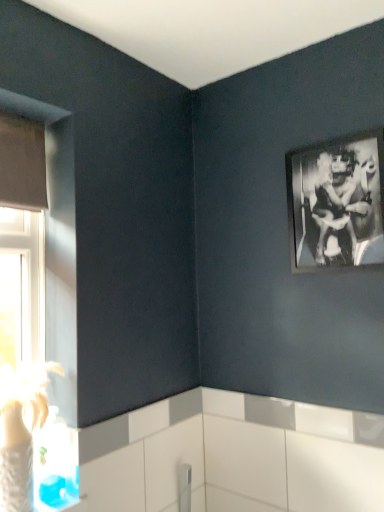
Measure the distance between black matte picture frame at upper right and camera.

The depth of black matte picture frame at upper right is 4.33 feet.

What do you see at coordinates (337, 204) in the screenshot? I see `black matte picture frame at upper right` at bounding box center [337, 204].

Locate an element on the screen. black matte picture frame at upper right is located at coordinates (337, 204).

In order to face black matte picture frame at upper right, should I rotate leftwards or rightwards?

To align with it, rotate right about 18.543°.

What is the approximate height of matte gray window at left?

1.08 meters.

What do you see at coordinates (22, 239) in the screenshot? Image resolution: width=384 pixels, height=512 pixels. I see `matte gray window at left` at bounding box center [22, 239].

The image size is (384, 512). What are the coordinates of `matte gray window at left` in the screenshot? It's located at (22, 239).

Image resolution: width=384 pixels, height=512 pixels. Identify the location of black matte picture frame at upper right. (337, 204).

Is black matte picture frame at upper right to the left of matte gray window at left from the viewer's perspective?

No, black matte picture frame at upper right is not to the left of matte gray window at left.

Does black matte picture frame at upper right come behind matte gray window at left?

Yes, black matte picture frame at upper right is behind matte gray window at left.

Which is less distant, (x=313, y=231) or (x=20, y=138)?

Clearly, point (x=313, y=231) is more distant from the camera than point (x=20, y=138).

From the image's perspective, which one is positioned higher, black matte picture frame at upper right or matte gray window at left?

black matte picture frame at upper right appears higher in the image.

From a real-world perspective, does black matte picture frame at upper right sit lower than matte gray window at left?

Incorrect, from a real-world perspective, black matte picture frame at upper right is higher than matte gray window at left.

Considering the relative sizes of black matte picture frame at upper right and matte gray window at left in the image provided, is black matte picture frame at upper right thinner than matte gray window at left?

Yes, black matte picture frame at upper right is thinner than matte gray window at left.

Which of these two, black matte picture frame at upper right or matte gray window at left, stands taller?

With more height is matte gray window at left.

Considering the sizes of black matte picture frame at upper right and matte gray window at left in the image, is black matte picture frame at upper right bigger or smaller than matte gray window at left?

Clearly, black matte picture frame at upper right is smaller in size than matte gray window at left.

Is matte gray window at left surrounded by black matte picture frame at upper right?

No, black matte picture frame at upper right does not contain matte gray window at left.

Is black matte picture frame at upper right positioned far away from matte gray window at left?

black matte picture frame at upper right is positioned a significant distance from matte gray window at left.

Is matte gray window at left at the back of black matte picture frame at upper right?

No, matte gray window at left is not at the back of black matte picture frame at upper right.

How different are the orientations of black matte picture frame at upper right and matte gray window at left in degrees?

90.6 degrees.

Image resolution: width=384 pixels, height=512 pixels. What are the coordinates of `picture frame above the matte gray window at left (from the image's perspective)` in the screenshot? It's located at (337, 204).

Considering the positions of objects matte gray window at left and black matte picture frame at upper right in the image provided, who is more to the right, matte gray window at left or black matte picture frame at upper right?

black matte picture frame at upper right is more to the right.

Is matte gray window at left in front of black matte picture frame at upper right?

Yes, it is.

Does point (1, 278) lie in front of point (332, 206)?

No, it is not.

From the image's perspective, between matte gray window at left and black matte picture frame at upper right, who is located below?

matte gray window at left.

From a real-world perspective, which is physically below, matte gray window at left or black matte picture frame at upper right?

matte gray window at left is physically lower.

Considering the sizes of objects matte gray window at left and black matte picture frame at upper right in the image provided, who is wider, matte gray window at left or black matte picture frame at upper right?

Wider between the two is matte gray window at left.

From their relative heights in the image, would you say matte gray window at left is taller or shorter than black matte picture frame at upper right?

Clearly, matte gray window at left is taller compared to black matte picture frame at upper right.

Who is smaller, matte gray window at left or black matte picture frame at upper right?

Smaller between the two is black matte picture frame at upper right.

In the scene shown: Can we say matte gray window at left lies outside black matte picture frame at upper right?

That's correct, matte gray window at left is outside of black matte picture frame at upper right.

Is matte gray window at left touching black matte picture frame at upper right?

No.

Is matte gray window at left oriented towards black matte picture frame at upper right?

No.

From the picture: Can you tell me how much matte gray window at left and black matte picture frame at upper right differ in facing direction?

The angle between the facing direction of matte gray window at left and the facing direction of black matte picture frame at upper right is 90.6 degrees.

Measure the distance between matte gray window at left and black matte picture frame at upper right.

matte gray window at left and black matte picture frame at upper right are 8.16 feet apart.

This screenshot has width=384, height=512. What are the coordinates of `window in front of the black matte picture frame at upper right` in the screenshot? It's located at (22, 239).

Locate an element on the screen. window directly beneath the black matte picture frame at upper right (from a real-world perspective) is located at coordinates (22, 239).

Locate an element on the screen. The image size is (384, 512). picture frame lying on the right of matte gray window at left is located at coordinates (337, 204).